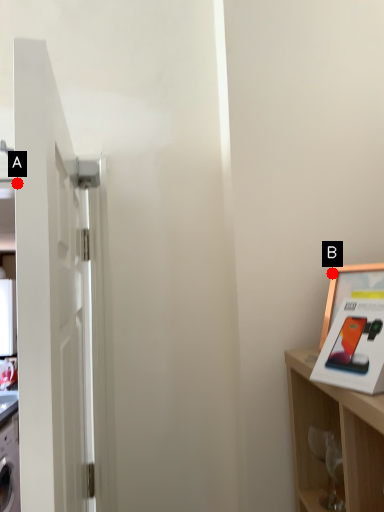
Question: Two points are circled on the image, labeled by A and B beside each circle. Which point appears closest to the camera in this image?

Choices:
 (A) A is closer
 (B) B is closer

Answer: (A)